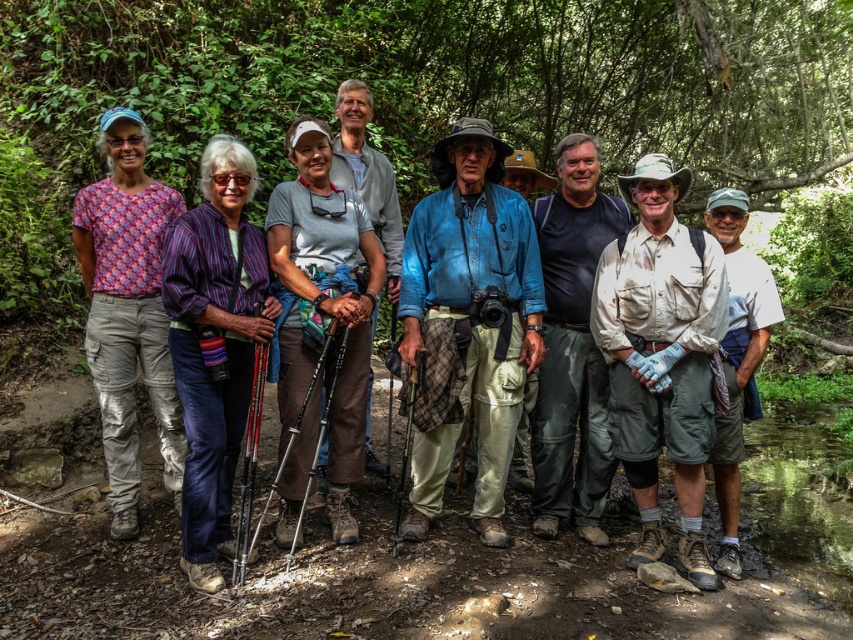
You are a photographer standing at the front of the group. You want to adjust the positions of the two people at point (x=468, y=308) and point (x=489, y=428) so that they are both facing the camera. Since you want them to be in the same row as the rest of the group, which person should move forward to align with the others?

The person at point (x=468, y=308) should move forward because they are currently behind point (x=489, y=428), so moving forward would bring them into alignment with the rest of the group.

You are part of the hiking group and want to take a photo of the two people in the matte purple shirt at center and denim shirt at center. Which one should you point the camera towards first if you are standing to the right of the group?

You should point the camera towards the matte purple shirt at center first because it is to the left of denim shirt at center, so when moving from right to left, the matte purple shirt at center comes first.